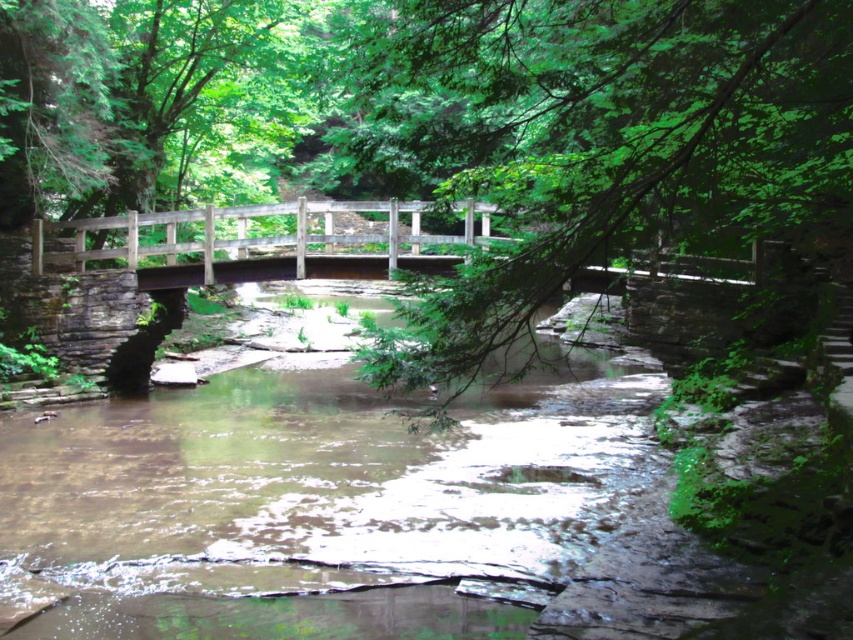
You are standing at the edge of the stream and notice a green leafy branch at center. Based on its position, can you determine if it is closer to the wooden bridge or the rocky bank?

The green leafy branch at center is located at point (598, 140), which places it closer to the wooden bridge than the rocky bank.

You are planning to cross the wooden bridge at center while holding a green leafy branch at center. Which object will you be able to carry more easily through the narrow path on the bridge?

The green leafy branch at center is thinner than the wooden bridge at center, so it will be easier to carry the green leafy branch at center through the narrow path on the bridge.

You are standing at the wooden bridge and looking down at the stream. There are two points marked on the water surface. Which point is closer to you, point at coordinate [801,1] or point at coordinate [76,224]?

Point at coordinate [801,1] is closer to you than point at coordinate [76,224].